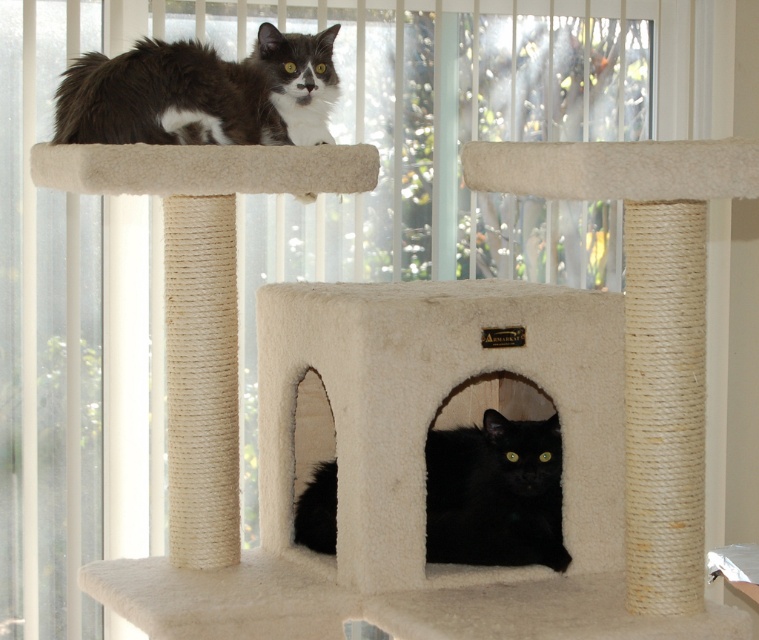
Question: Is gray and white fur cat at upper left smaller than black fuzzy cat at lower center?

Choices:
 (A) yes
 (B) no

Answer: (B)

Question: Does gray and white fur cat at upper left appear on the right side of black fuzzy cat at lower center?

Choices:
 (A) yes
 (B) no

Answer: (B)

Question: Which point appears farthest from the camera in this image?

Choices:
 (A) (95, 67)
 (B) (331, 502)

Answer: (B)

Question: Does gray and white fur cat at upper left have a greater width compared to black fuzzy cat at lower center?

Choices:
 (A) no
 (B) yes

Answer: (B)